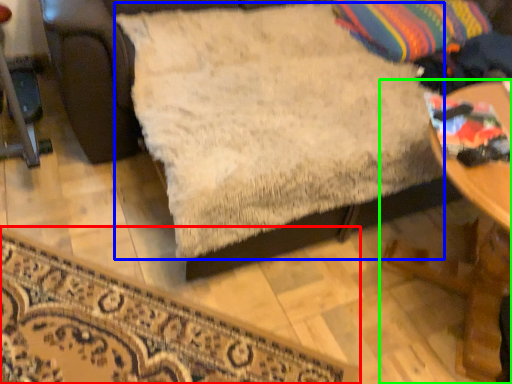
Question: Which is farther away from furniture (highlighted by a red box)? sheet (highlighted by a blue box) or table (highlighted by a green box)?

Choices:
 (A) sheet
 (B) table

Answer: (B)